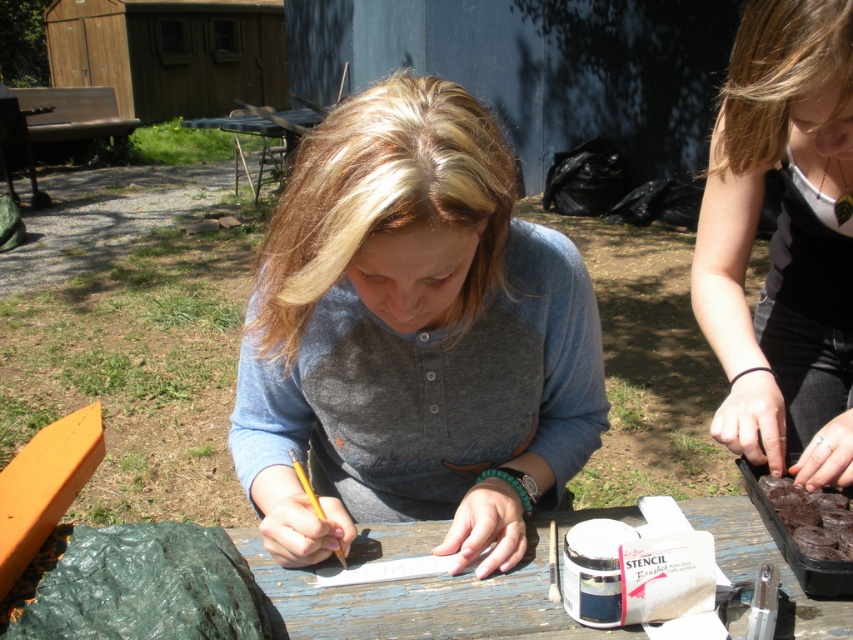
Which is below, matte black shirt at upper right or dark chocolate cake at lower right?

dark chocolate cake at lower right is lower down.

Is matte black shirt at upper right further to camera compared to dark chocolate cake at lower right?

No, it is not.

Is point (785, 381) farther from camera compared to point (793, 532)?

Yes, it is behind point (793, 532).

Locate an element on the screen. This screenshot has height=640, width=853. matte black shirt at upper right is located at coordinates (782, 241).

Does matte black shirt at upper right have a greater width compared to wooden table at center?

Incorrect, matte black shirt at upper right's width does not surpass wooden table at center's.

Is point (802, 349) behind point (607, 515)?

Yes, point (802, 349) is behind point (607, 515).

Which is in front, point (802, 444) or point (426, 536)?

Point (426, 536) is more forward.

At what (x,y) coordinates should I click in order to perform the action: click on matte black shirt at upper right. Please return your answer as a coordinate pair (x, y). This screenshot has width=853, height=640. Looking at the image, I should click on (782, 241).

Image resolution: width=853 pixels, height=640 pixels. What do you see at coordinates (413, 337) in the screenshot? I see `matte gray shirt at center` at bounding box center [413, 337].

Based on the photo, does matte gray shirt at center appear on the right side of wooden table at center?

In fact, matte gray shirt at center is to the left of wooden table at center.

Is point (289, 355) positioned in front of point (828, 608)?

No, it is not.

The height and width of the screenshot is (640, 853). Find the location of `matte gray shirt at center`. matte gray shirt at center is located at coordinates (413, 337).